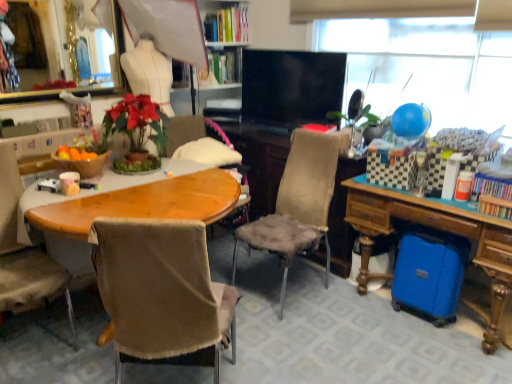
The image size is (512, 384). I want to click on velvet-like beige chair at center, which ranks as the 1th chair in right-to-left order, so click(297, 205).

Locate an element on the screen. This screenshot has height=384, width=512. brown fabric chair at center, marked as the 2th chair in a right-to-left arrangement is located at coordinates (162, 293).

The width and height of the screenshot is (512, 384). What do you see at coordinates (25, 254) in the screenshot?
I see `brown fabric chair at left, which ranks as the third chair in right-to-left order` at bounding box center [25, 254].

Locate an element on the screen. This screenshot has width=512, height=384. blue glossy balloon at upper right is located at coordinates (411, 120).

Find the location of a particular element. This screenshot has width=512, height=384. black glossy flat-screen tv at center is located at coordinates (291, 87).

You are a GUI agent. You are given a task and a screenshot of the screen. Output one action in this format:
    pyautogui.click(x=<x>, y=<y>)
    Task: Click on the velvet-like beige chair at center, which appears as the third chair when viewed from the left
    
    Given the screenshot: What is the action you would take?
    pyautogui.click(x=297, y=205)

Is wooden desk at lower right turned away from brown fabric chair at center?

No, wooden desk at lower right's orientation is not away from brown fabric chair at center.

Is wooden desk at lower right to the left or to the right of brown fabric chair at center in the image?

From the image, it's evident that wooden desk at lower right is to the right of brown fabric chair at center.

Considering the positions of points (447, 224) and (190, 143), is point (447, 224) farther from camera compared to point (190, 143)?

That is False.

Locate an element on the screen. The height and width of the screenshot is (384, 512). chair behind the brown fabric chair at left, the first chair viewed from the left is located at coordinates (297, 205).

Is velvet-like beige chair at center, which appears as the third chair when viewed from the left, shorter than brown fabric chair at left, which ranks as the third chair in right-to-left order?

No, velvet-like beige chair at center, which appears as the third chair when viewed from the left, is not shorter than brown fabric chair at left, which ranks as the third chair in right-to-left order.

Is point (288, 238) behind point (71, 319)?

Yes, it is.

Which is closer to the camera, (413, 33) or (362, 223)?

Positioned in front is point (362, 223).

Is blue matte globe at upper right in front of wooden desk at lower right?

No, blue matte globe at upper right is further to the viewer.

Considering the sizes of objects blue matte globe at upper right and wooden desk at lower right in the image provided, who is wider, blue matte globe at upper right or wooden desk at lower right?

wooden desk at lower right is wider.

How much distance is there between blue matte globe at upper right and wooden desk at lower right?

blue matte globe at upper right is 37.93 inches from wooden desk at lower right.

Can you tell me how much brown fabric chair at center and velvet-like beige chair at center, which appears as the third chair when viewed from the left, differ in facing direction?

123 degrees separate the facing orientations of brown fabric chair at center and velvet-like beige chair at center, which appears as the third chair when viewed from the left.

Is brown fabric chair at center closer to the viewer compared to velvet-like beige chair at center, which ranks as the 1th chair in right-to-left order?

No, it is behind velvet-like beige chair at center, which ranks as the 1th chair in right-to-left order.

You are a GUI agent. You are given a task and a screenshot of the screen. Output one action in this format:
    pyautogui.click(x=<x>, y=<y>)
    Task: Click on the chair lying on the right of brown fabric chair at center
    The image size is (512, 384).
    Given the screenshot: What is the action you would take?
    pyautogui.click(x=297, y=205)

Considering the points (237, 178) and (322, 190), which point is in front, point (237, 178) or point (322, 190)?

Positioned in front is point (322, 190).

Locate an element on the screen. The image size is (512, 384). chair that is the 3rd one when counting forward from the black glossy flat-screen tv at center is located at coordinates (162, 293).

Which object is more forward, brown fabric chair at center, the second chair viewed from the left, or black glossy flat-screen tv at center?

brown fabric chair at center, the second chair viewed from the left.

Does brown fabric chair at center, the second chair viewed from the left, have a greater width compared to black glossy flat-screen tv at center?

Yes, brown fabric chair at center, the second chair viewed from the left, is wider than black glossy flat-screen tv at center.

Would you say brown fabric chair at center, marked as the 2th chair in a right-to-left arrangement, contains black glossy flat-screen tv at center?

Actually, black glossy flat-screen tv at center is outside brown fabric chair at center, marked as the 2th chair in a right-to-left arrangement.

From the picture: Does brown fabric chair at left, which ranks as the third chair in right-to-left order, have a larger size compared to blue glossy balloon at upper right?

Correct, brown fabric chair at left, which ranks as the third chair in right-to-left order, is larger in size than blue glossy balloon at upper right.

From a real-world perspective, which is physically below, brown fabric chair at left, the first chair viewed from the left, or blue glossy balloon at upper right?

brown fabric chair at left, the first chair viewed from the left, from a real-world perspective.

Between brown fabric chair at left, the first chair viewed from the left, and blue glossy balloon at upper right, which one appears on the left side from the viewer's perspective?

From the viewer's perspective, brown fabric chair at left, the first chair viewed from the left, appears more on the left side.

Which of these two, brown fabric chair at left, which ranks as the third chair in right-to-left order, or blue glossy balloon at upper right, stands shorter?

blue glossy balloon at upper right is shorter.

From a real-world perspective, does black glossy flat-screen tv at center stand above brown fabric chair at left, which ranks as the third chair in right-to-left order?

Indeed, from a real-world perspective, black glossy flat-screen tv at center stands above brown fabric chair at left, which ranks as the third chair in right-to-left order.

Considering the positions of objects black glossy flat-screen tv at center and brown fabric chair at left, the first chair viewed from the left, in the image provided, who is more to the left, black glossy flat-screen tv at center or brown fabric chair at left, the first chair viewed from the left,?

Positioned to the left is brown fabric chair at left, the first chair viewed from the left.

From the image's perspective, is black glossy flat-screen tv at center located beneath brown fabric chair at left, which ranks as the third chair in right-to-left order?

No.

Image resolution: width=512 pixels, height=384 pixels. Identify the location of desk on the right of brown fabric chair at center. (441, 230).

There is a velvet-like beige chair at center, which appears as the third chair when viewed from the left. Where is `the 1st chair below it (from the image's perspective)`? The width and height of the screenshot is (512, 384). the 1st chair below it (from the image's perspective) is located at coordinates (25, 254).

Which object lies nearer to the anchor point brown fabric chair at center, wooden desk at lower right or black glossy flat-screen tv at center?

Among the two, black glossy flat-screen tv at center is located nearer to brown fabric chair at center.

Based on their spatial positions, is black glossy flat-screen tv at center or brown fabric chair at center further from blue glossy balloon at upper right?

brown fabric chair at center is positioned further to the anchor blue glossy balloon at upper right.

From the image, which object appears to be farther from blue matte globe at upper right, black glossy flat-screen tv at center or wooden desk at lower right?

Among the two, wooden desk at lower right is located further to blue matte globe at upper right.

In the scene shown: Estimate the real-world distances between objects in this image. Which object is further from brown fabric chair at center, blue glossy balloon at upper right or brown fabric chair at center, the second chair viewed from the left?

The object further to brown fabric chair at center is brown fabric chair at center, the second chair viewed from the left.

Which object lies nearer to the anchor point blue glossy balloon at upper right, blue matte globe at upper right or brown fabric chair at left, the first chair viewed from the left?

blue matte globe at upper right.

Looking at the image, which one is located further to blue matte globe at upper right, blue glossy balloon at upper right or wooden desk at lower right?

wooden desk at lower right lies further to blue matte globe at upper right than the other object.

From the picture: Based on their spatial positions, is blue matte globe at upper right or brown fabric chair at center, marked as the 2th chair in a right-to-left arrangement, closer to blue glossy balloon at upper right?

blue matte globe at upper right lies closer to blue glossy balloon at upper right than the other object.

When comparing their distances from blue matte globe at upper right, does blue glossy balloon at upper right or brown fabric chair at center seem closer?

The object closer to blue matte globe at upper right is blue glossy balloon at upper right.

Where is `balloon between blue matte globe at upper right and wooden desk at lower right vertically`? balloon between blue matte globe at upper right and wooden desk at lower right vertically is located at coordinates (411, 120).

Find the location of a particular element. television situated between brown fabric chair at center and wooden desk at lower right from left to right is located at coordinates (291, 87).

Locate an element on the screen. balloon between black glossy flat-screen tv at center and wooden desk at lower right in the up-down direction is located at coordinates (411, 120).

This screenshot has width=512, height=384. Identify the location of television situated between brown fabric chair at left, the first chair viewed from the left, and wooden desk at lower right from left to right. (291, 87).